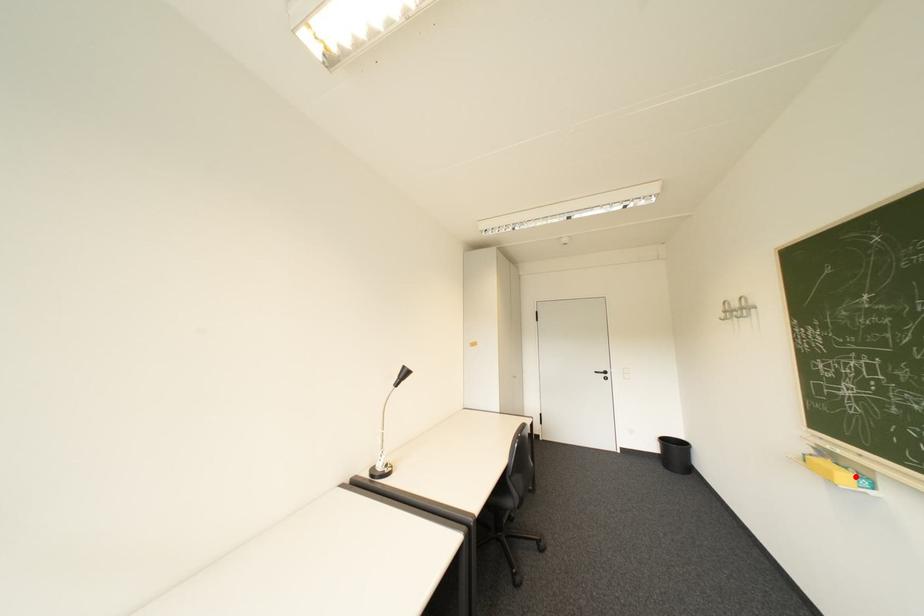
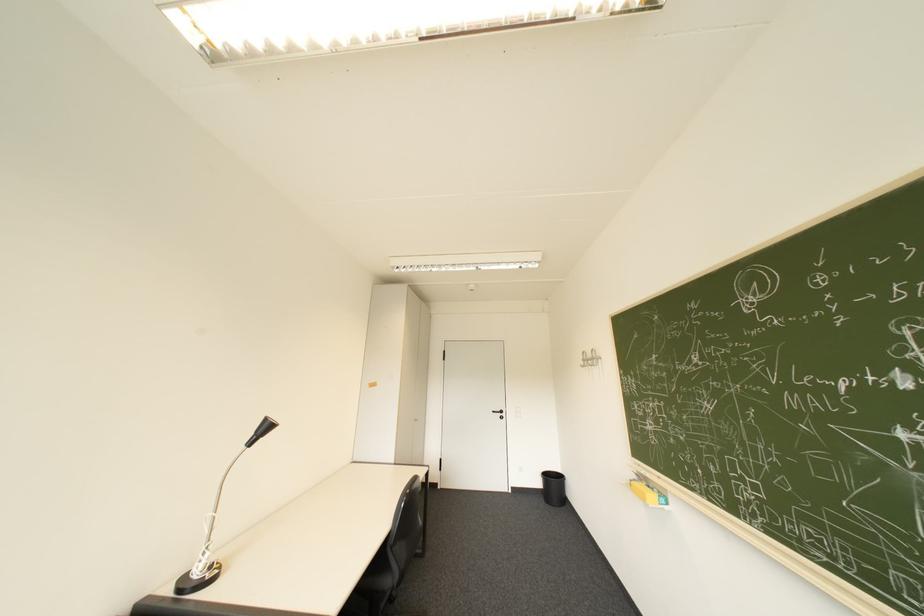
The point at the highlighted location is marked in the first image. Where is the corresponding point in the second image?

(662, 496)